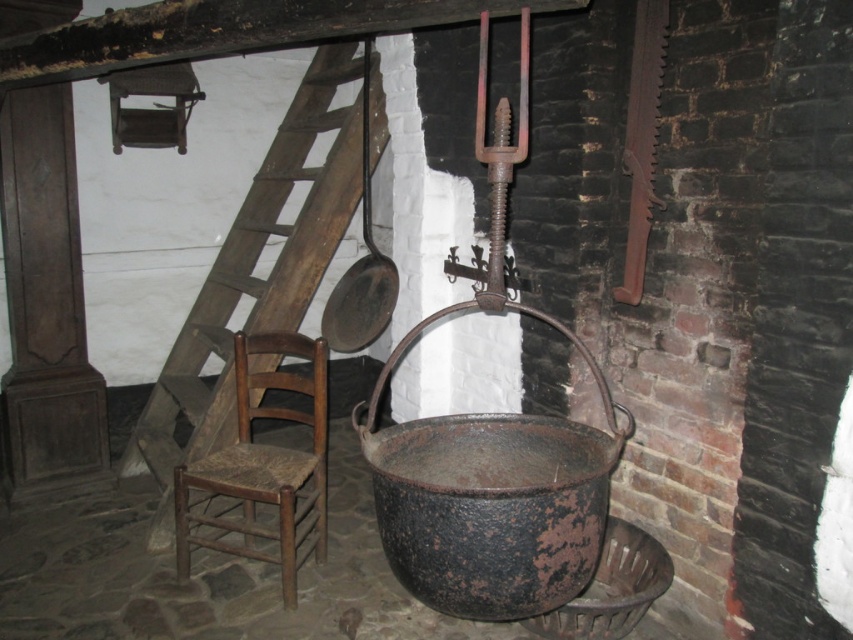
Who is more distant from viewer, (144, 412) or (111, 29)?

Point (144, 412)

From the picture: Can you confirm if wooden ladder at center is positioned to the right of dark brown wooden beam at upper center?

In fact, wooden ladder at center is to the left of dark brown wooden beam at upper center.

Between point (346, 116) and point (73, 49), which one is positioned in front?

Point (73, 49)

This screenshot has height=640, width=853. What are the coordinates of `wooden ladder at center` in the screenshot? It's located at [x=256, y=276].

Which is more to the left, wooden ladder at center or wooden woven seat chair at left?

From the viewer's perspective, wooden ladder at center appears more on the left side.

Is wooden ladder at center wider than wooden woven seat chair at left?

Indeed, wooden ladder at center has a greater width compared to wooden woven seat chair at left.

Who is more distant from viewer, [222,344] or [206,544]?

Point [222,344]

Locate an element on the screen. This screenshot has width=853, height=640. wooden ladder at center is located at coordinates (256, 276).

Looking at this image, is dark brown wooden beam at upper center thinner than wooden woven seat chair at left?

In fact, dark brown wooden beam at upper center might be wider than wooden woven seat chair at left.

Looking at this image, does dark brown wooden beam at upper center lie in front of wooden woven seat chair at left?

Yes, dark brown wooden beam at upper center is in front of wooden woven seat chair at left.

Is point (498, 16) closer to viewer compared to point (241, 390)?

Yes, point (498, 16) is closer to viewer.

The height and width of the screenshot is (640, 853). What are the coordinates of `dark brown wooden beam at upper center` in the screenshot? It's located at (224, 32).